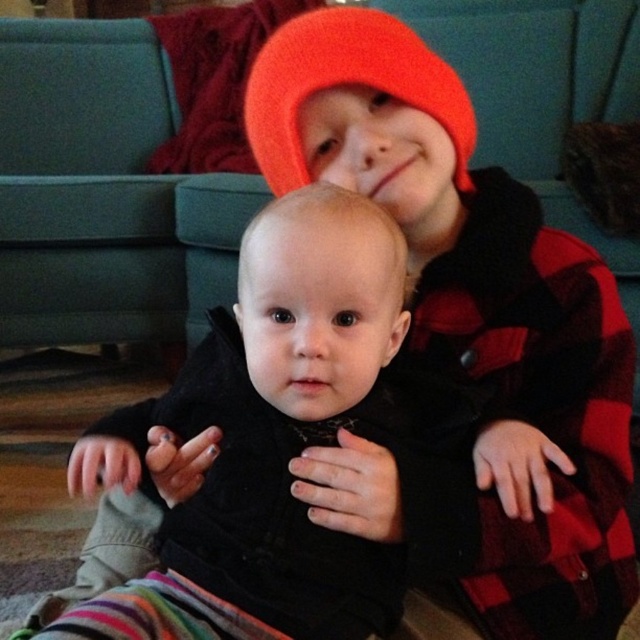
Question: Which point appears closest to the camera in this image?

Choices:
 (A) (268, 116)
 (B) (234, 352)

Answer: (B)

Question: Is black matte baby at center thinner than orange knit beanie at upper center?

Choices:
 (A) no
 (B) yes

Answer: (A)

Question: Among these objects, which one is nearest to the camera?

Choices:
 (A) black matte baby at center
 (B) orange knit beanie at upper center

Answer: (A)

Question: Which point is farther from the camera taking this photo?

Choices:
 (A) (330, 10)
 (B) (150, 449)

Answer: (A)

Question: Is black matte baby at center to the right of orange knit beanie at upper center from the viewer's perspective?

Choices:
 (A) yes
 (B) no

Answer: (B)

Question: Does black matte baby at center appear on the right side of orange knit beanie at upper center?

Choices:
 (A) no
 (B) yes

Answer: (A)